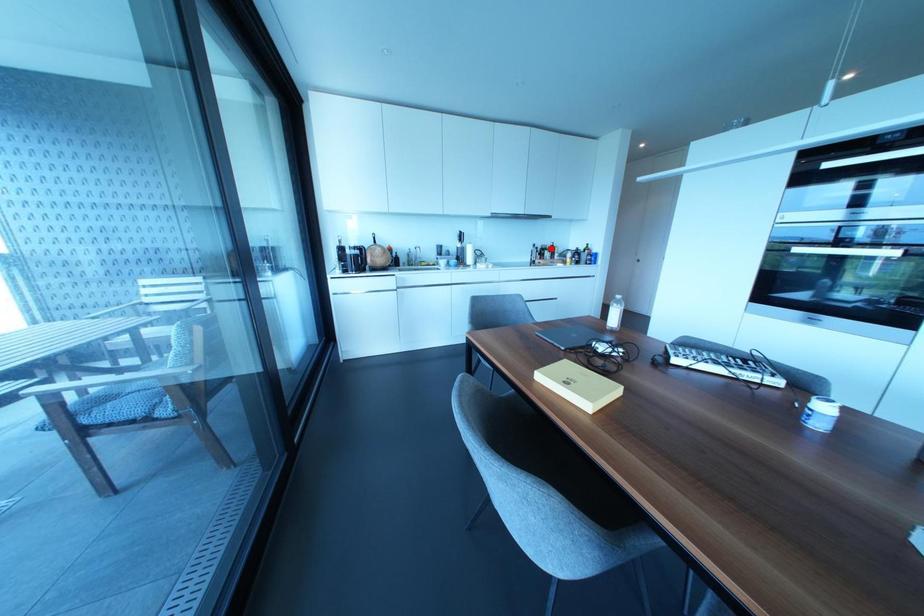
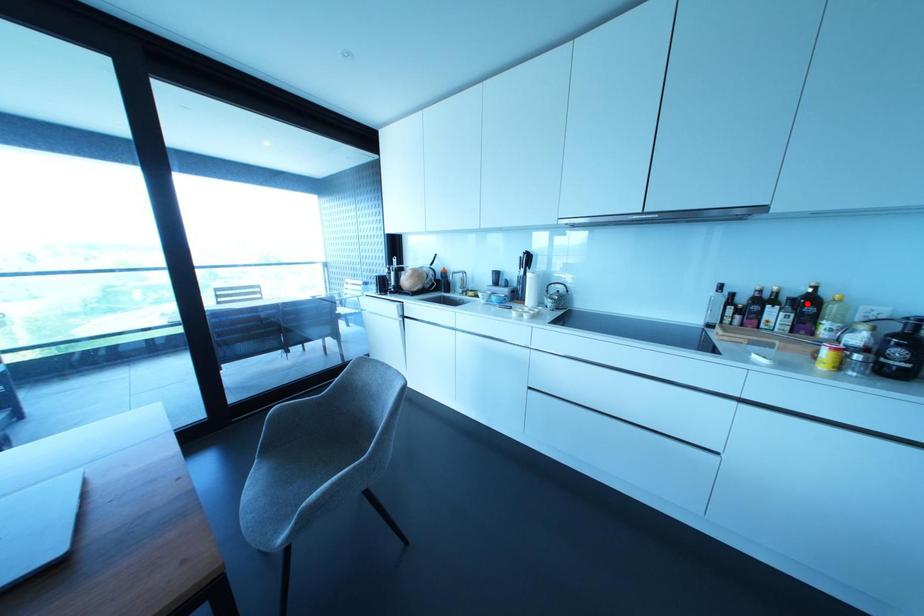
I am providing you with two images of the same scene from different viewpoints. A red point is marked on the first image and another point is marked on the second image. Are the points marked in image1 and image2 representing the same 3D position?

Yes